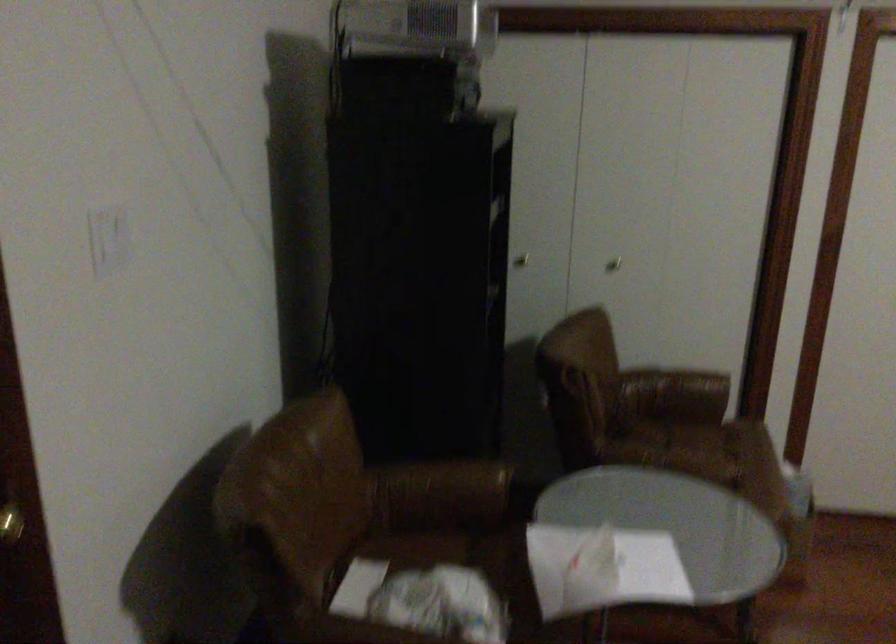
Where is `door knob`? This screenshot has width=896, height=644. door knob is located at coordinates (10, 524).